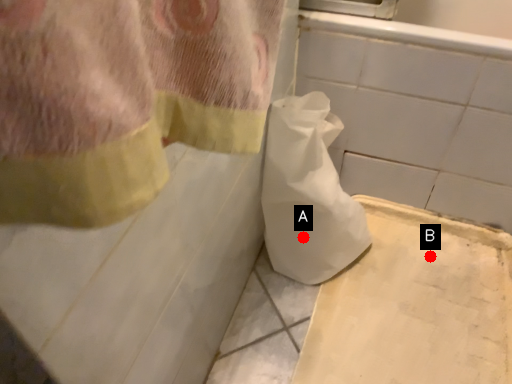
Question: Two points are circled on the image, labeled by A and B beside each circle. Among these points, which one is farthest from the camera?

Choices:
 (A) A is further
 (B) B is further

Answer: (B)